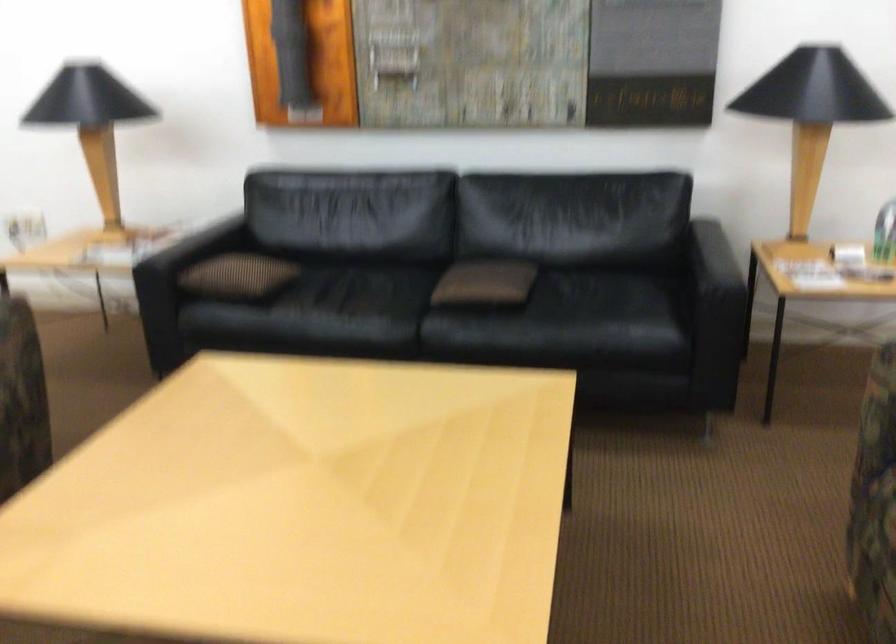
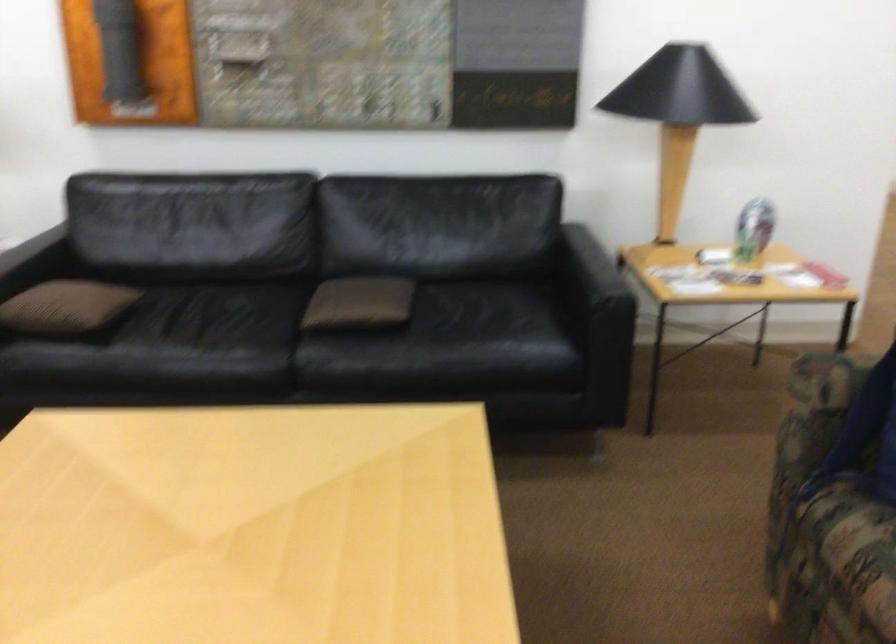
In the second image, find the point that corresponds to pixel 466 283 in the first image.

(340, 304)